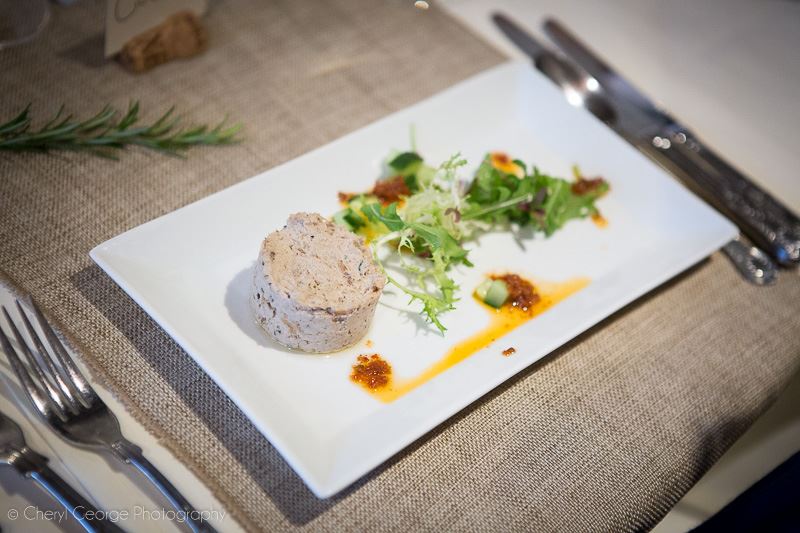
Find the location of a particular element. light brown woven table runner is located at coordinates (270, 80), (620, 400).